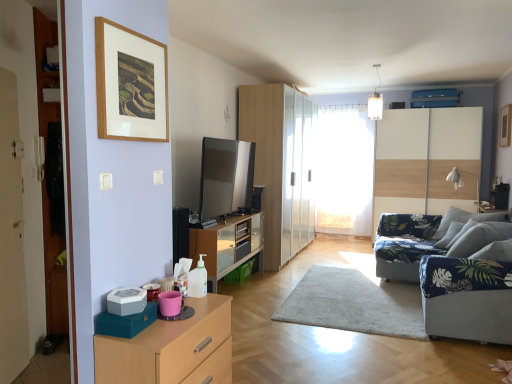
Question: From a real-world perspective, is transparent glass wardrobe at center located higher than light wood/wooden chest of drawers at lower left?

Choices:
 (A) yes
 (B) no

Answer: (A)

Question: Is transparent glass wardrobe at center to the left of light wood/wooden chest of drawers at lower left from the viewer's perspective?

Choices:
 (A) no
 (B) yes

Answer: (A)

Question: From the image's perspective, does transparent glass wardrobe at center appear lower than light wood/wooden chest of drawers at lower left?

Choices:
 (A) yes
 (B) no

Answer: (B)

Question: Can you confirm if transparent glass wardrobe at center is positioned to the right of light wood/wooden chest of drawers at lower left?

Choices:
 (A) yes
 (B) no

Answer: (A)

Question: Is transparent glass wardrobe at center outside of light wood/wooden chest of drawers at lower left?

Choices:
 (A) no
 (B) yes

Answer: (B)

Question: Visually, is light wood/wooden chest of drawers at lower left positioned to the left or to the right of white sheer curtain at center?

Choices:
 (A) right
 (B) left

Answer: (B)

Question: Looking at their shapes, would you say light wood/wooden chest of drawers at lower left is wider or thinner than white sheer curtain at center?

Choices:
 (A) wide
 (B) thin

Answer: (A)

Question: Which is correct: light wood/wooden chest of drawers at lower left is inside white sheer curtain at center, or outside of it?

Choices:
 (A) outside
 (B) inside

Answer: (A)

Question: Considering the positions of light wood/wooden chest of drawers at lower left and white sheer curtain at center in the image, is light wood/wooden chest of drawers at lower left taller or shorter than white sheer curtain at center?

Choices:
 (A) short
 (B) tall

Answer: (A)

Question: In terms of height, does white glossy dresser at right, which is the first dresser in right-to-left order, look taller or shorter compared to satin silver tv at center, which is the first appliance from right to left?

Choices:
 (A) tall
 (B) short

Answer: (A)

Question: Is white glossy dresser at right, which is the first dresser in right-to-left order, situated inside satin silver tv at center, positioned as the second appliance in front-to-back order, or outside?

Choices:
 (A) inside
 (B) outside

Answer: (B)

Question: In terms of width, does white glossy dresser at right, which is the first dresser in right-to-left order, look wider or thinner when compared to satin silver tv at center, the 1th appliance in the top-to-bottom sequence?

Choices:
 (A) wide
 (B) thin

Answer: (A)

Question: Is white glossy dresser at right, the 1th dresser viewed from the back, in front of or behind satin silver tv at center, the 2th appliance positioned from the left, in the image?

Choices:
 (A) behind
 (B) front

Answer: (A)

Question: Is blue fabric armchair at right spatially inside transparent glass wardrobe at center, or outside of it?

Choices:
 (A) inside
 (B) outside

Answer: (B)

Question: Is blue fabric armchair at right wider or thinner than transparent glass wardrobe at center?

Choices:
 (A) wide
 (B) thin

Answer: (A)